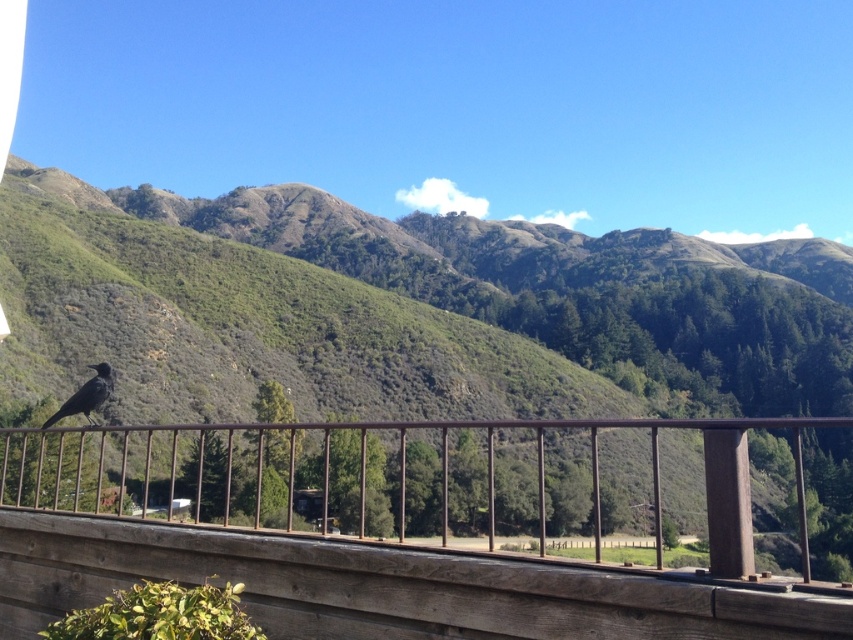
Does brown wooden balcony at lower left appear on the left side of shiny black bird at lower left?

No, brown wooden balcony at lower left is not to the left of shiny black bird at lower left.

Is brown wooden balcony at lower left below shiny black bird at lower left?

Yes.

Does point (97, 531) lie behind point (80, 394)?

No, it is in front of (80, 394).

Locate an element on the screen. This screenshot has height=640, width=853. brown wooden balcony at lower left is located at coordinates (387, 532).

Who is positioned more to the right, green textured hillside at center or brown wooden balcony at lower left?

green textured hillside at center is more to the right.

Is point (827, 349) more distant than point (99, 499)?

Yes.

The image size is (853, 640). What do you see at coordinates (421, 304) in the screenshot?
I see `green textured hillside at center` at bounding box center [421, 304].

Find the location of a particular element. This screenshot has height=640, width=853. green textured hillside at center is located at coordinates (421, 304).

Does point (381, 252) come farther from viewer compared to point (91, 385)?

Yes, point (381, 252) is farther from viewer.

At what (x,y) coordinates should I click in order to perform the action: click on green textured hillside at center. Please return your answer as a coordinate pair (x, y). This screenshot has height=640, width=853. Looking at the image, I should click on (421, 304).

Find the location of `green textured hillside at center`. green textured hillside at center is located at coordinates (421, 304).